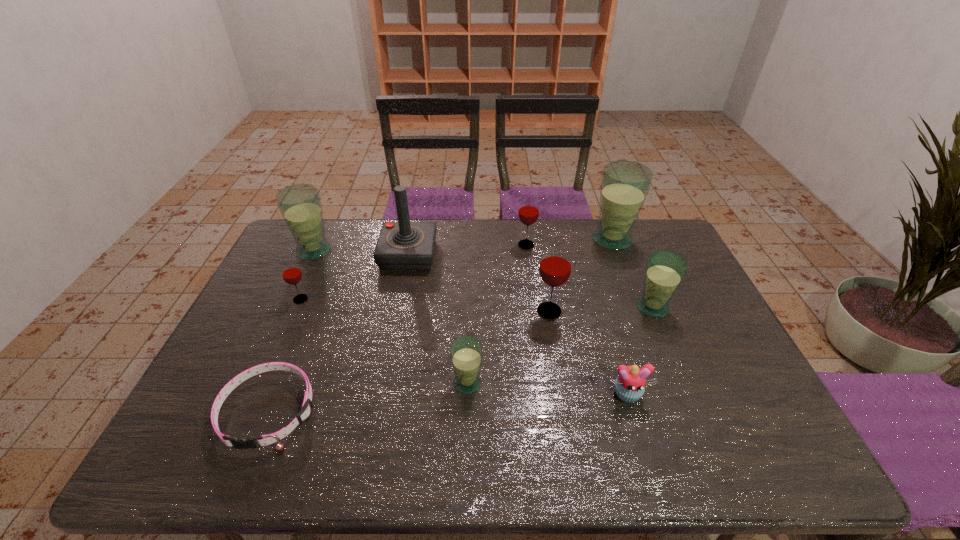
Image resolution: width=960 pixels, height=540 pixels. In order to click on cupcake in this screenshot , I will do `click(630, 384)`.

Image resolution: width=960 pixels, height=540 pixels. I want to click on pink dog collar, so click(x=263, y=440).

Identify the location of dog collar. This screenshot has height=540, width=960. (263, 440).

This screenshot has height=540, width=960. I want to click on free location located on the right of the tallest glass, so click(671, 240).

Where is `free point located on the rectangular base of the joystick`? The width and height of the screenshot is (960, 540). free point located on the rectangular base of the joystick is located at coordinates (401, 288).

At what (x,y) coordinates should I click in order to perform the action: click on free space located on the right of the leftmost blue glass. Please return your answer as a coordinate pair (x, y). The height and width of the screenshot is (540, 960). Looking at the image, I should click on (376, 251).

At what (x,y) coordinates should I click in order to perform the action: click on vacant space situated 0.260m on the front of the biggest red glass. Please return your answer as a coordinate pair (x, y). This screenshot has height=540, width=960. Looking at the image, I should click on (564, 400).

Locate an element on the screen. free space located 0.080m on the back of the second biggest red glass is located at coordinates (523, 226).

Identify the location of free space located on the front of the second nearest blue glass. This screenshot has width=960, height=540. (690, 397).

Identify the location of free space located on the front of the smallest red glass. (252, 411).